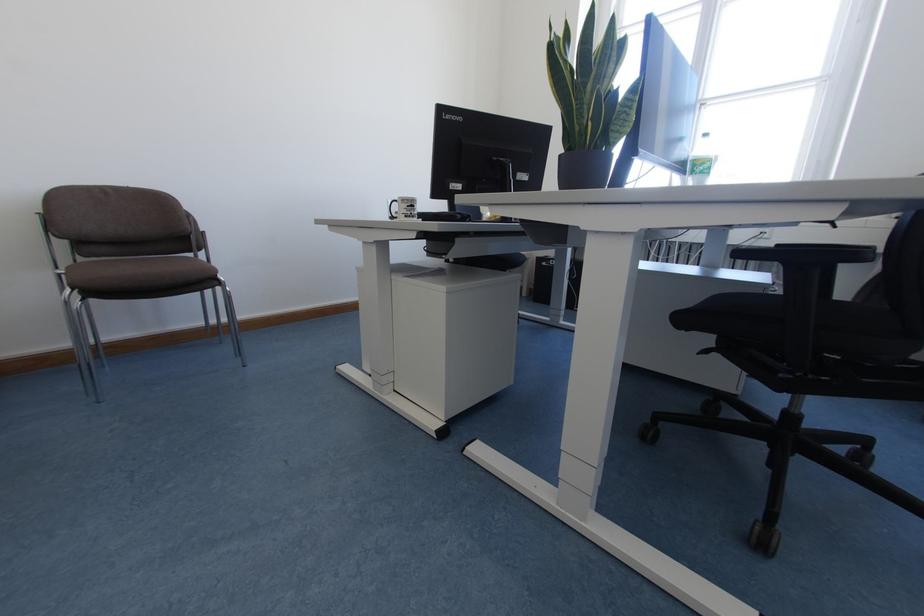
Where would you lift the green plastic bottle? Please return your answer as a coordinate pair (x, y).

(700, 161)